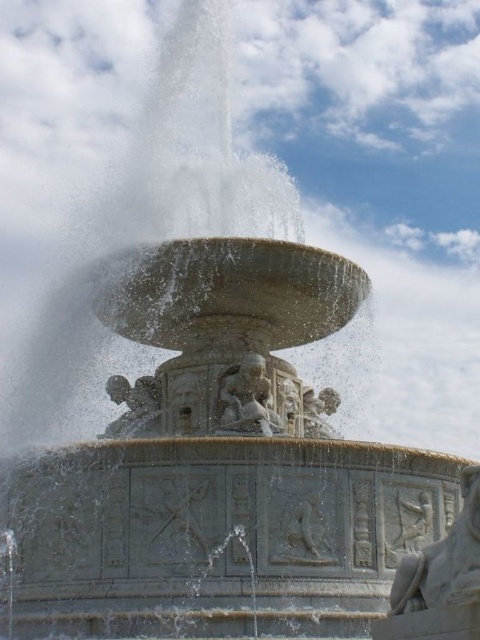
Does gray stone relief at center have a greater height compared to white marble statue at center?

Yes.

Does gray stone relief at center appear on the right side of white marble statue at center?

Yes, gray stone relief at center is to the right of white marble statue at center.

The width and height of the screenshot is (480, 640). In order to click on gray stone relief at center in this screenshot , I will do point(444,561).

This screenshot has height=640, width=480. I want to click on gray stone relief at center, so click(x=444, y=561).

Is gray stone relief at center closer to camera compared to polished stone cherub at center?

Yes, gray stone relief at center is in front of polished stone cherub at center.

Which of these two, gray stone relief at center or polished stone cherub at center, stands taller?

gray stone relief at center

Is point (437, 596) closer to camera compared to point (338, 397)?

Yes.

Identify the location of gray stone relief at center. This screenshot has width=480, height=640. (444, 561).

Is gray stone relief at center positioned in front of carved stone cherub at center?

Yes, gray stone relief at center is in front of carved stone cherub at center.

Who is shorter, gray stone relief at center or carved stone cherub at center?

carved stone cherub at center is shorter.

Who is more distant from viewer, (468, 566) or (156, 381)?

Positioned behind is point (156, 381).

At what (x,y) coordinates should I click in order to perform the action: click on gray stone relief at center. Please return your answer as a coordinate pair (x, y). Looking at the image, I should click on (444, 561).